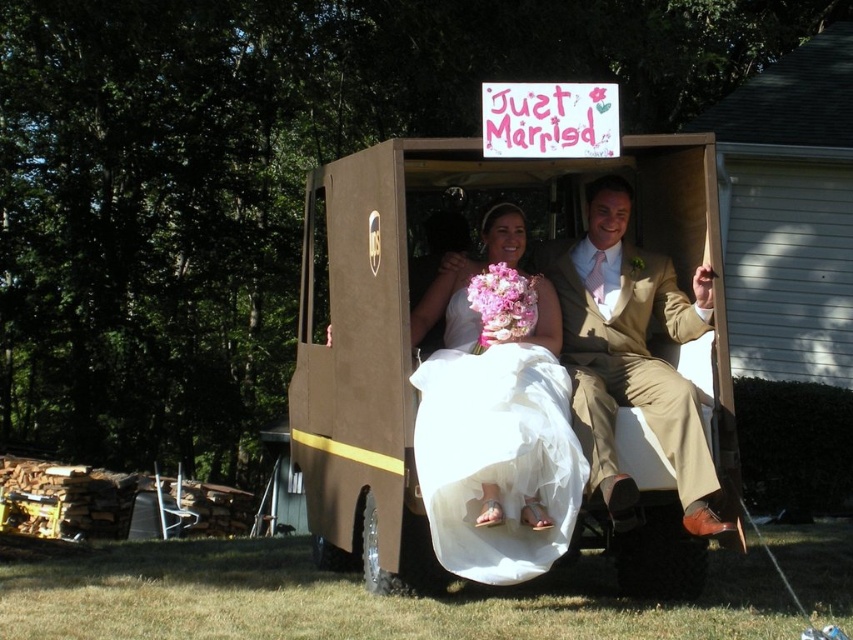
Based on the photo, you are a photographer setting up for a wedding photo shoot. The scene requires the brown cardboard golf cart at center and the tan fabric suit at center to be visible in the frame. Given their sizes, which object should you focus on to ensure both are clearly captured without cropping?

The brown cardboard golf cart at center is larger than the tan fabric suit at center. To ensure both are clearly captured without cropping, focus on the brown cardboard golf cart at center as it occupies more space in the frame.

You are a photographer at the wedding and want to capture a photo of the bride in her white satin dress at center and her pink silk bouquet at center. From the bride and bouquet perspective, which side should the photographer stand to ensure both are fully visible in the frame?

The photographer should stand to the right side of the white satin dress at center and pink silk bouquet at center because the white satin dress at center is to the left of the pink silk bouquet at center, so positioning themselves to the right would allow both to be fully visible without obstruction.